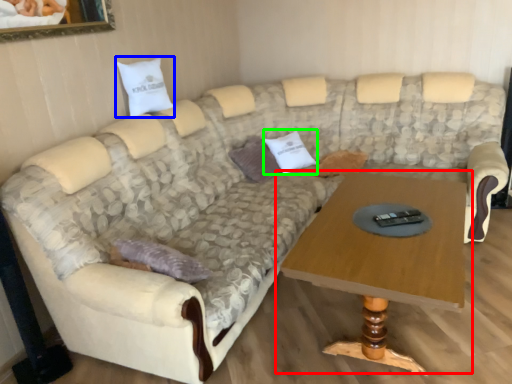
Question: Based on their relative distances, which object is farther from coffee table (highlighted by a red box)? Choose from pillow (highlighted by a blue box) and pillow (highlighted by a green box).

Choices:
 (A) pillow
 (B) pillow

Answer: (A)